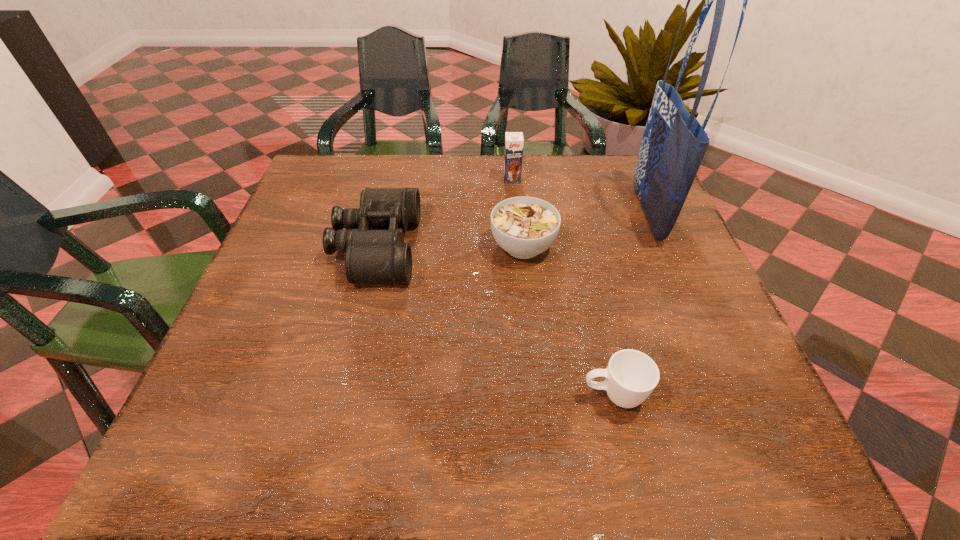
Find the location of a particular element. This screenshot has width=960, height=540. the rightmost object is located at coordinates (674, 143).

You are a GUI agent. You are given a task and a screenshot of the screen. Output one action in this format:
    pyautogui.click(x=<x>, y=<y>)
    Task: Click on the tallest object
    The width and height of the screenshot is (960, 540).
    Given the screenshot: What is the action you would take?
    pyautogui.click(x=674, y=143)

Identify the location of the fourth shortest object. The height and width of the screenshot is (540, 960). (514, 141).

This screenshot has height=540, width=960. I want to click on the leftmost object, so click(373, 240).

The width and height of the screenshot is (960, 540). What are the coordinates of `binoculars` in the screenshot? It's located at (373, 240).

Where is `soup bowl`? This screenshot has height=540, width=960. soup bowl is located at coordinates (524, 227).

Locate an element on the screen. The image size is (960, 540). the nearest object is located at coordinates (631, 376).

I want to click on vacant area situated 0.230m on the front-facing side of the rightmost object, so click(x=541, y=213).

The image size is (960, 540). What are the coordinates of `vacant point located on the front-facing side of the rightmost object` in the screenshot? It's located at (480, 213).

Identify the location of vacant space located on the front-facing side of the rightmost object. (505, 213).